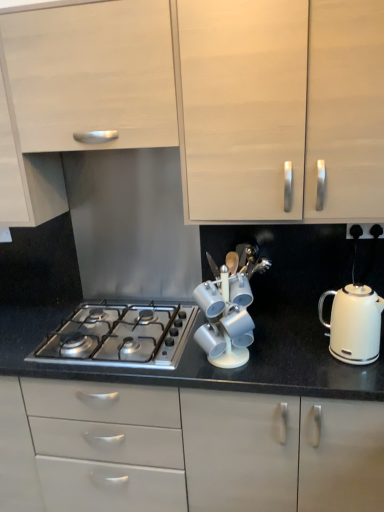
Locate an element on the screen. This screenshot has height=512, width=384. free region on the left part of white glossy kettle at right is located at coordinates (292, 358).